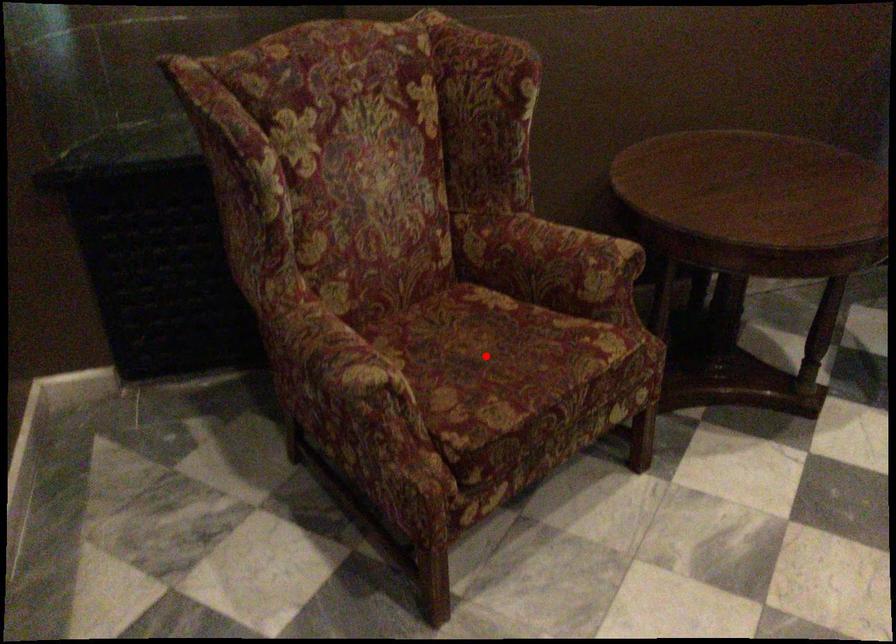
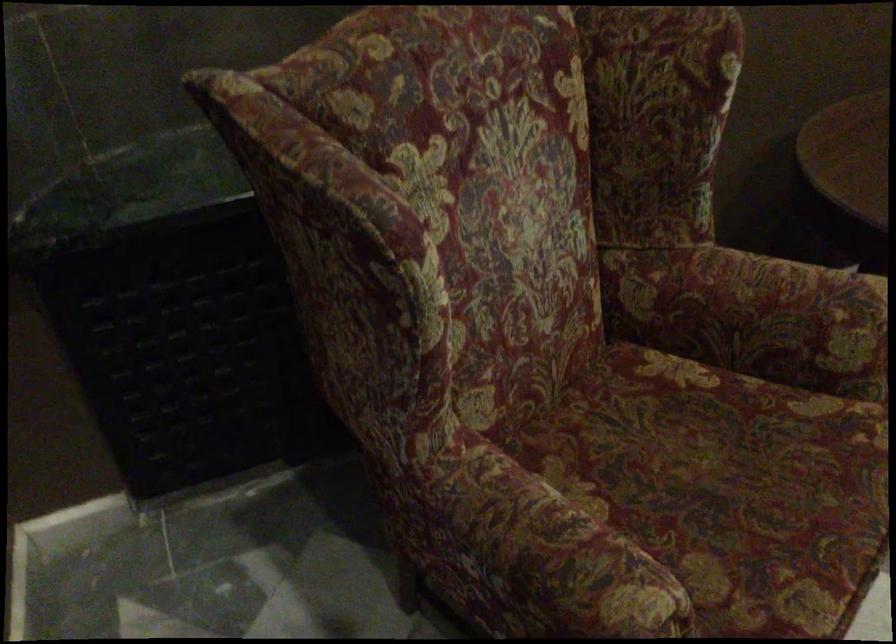
In the second image, find the point that corresponds to the highlighted location in the first image.

(726, 486)